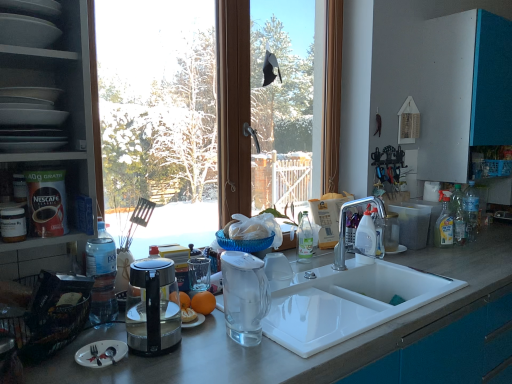
Locate an element on the screen. free space in front of transparent glass blender at sink is located at coordinates (237, 362).